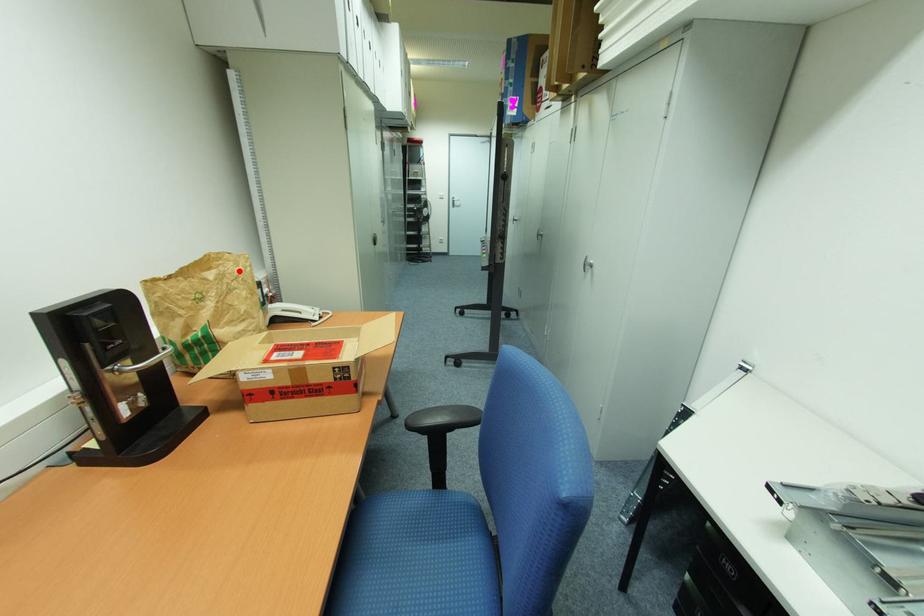
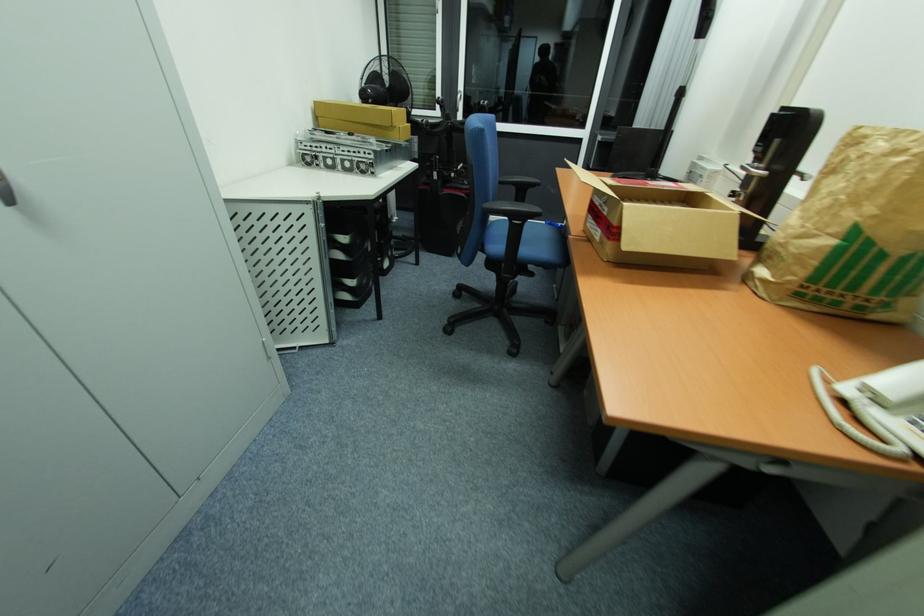
Question: I am providing you with two images of the same scene from different viewpoints. Image1 has a red point marked. In image2, the corresponding 3D location appears at what relative position? Reply with the corresponding letter.

Choices:
 (A) Closer
 (B) Farther

Answer: (B)